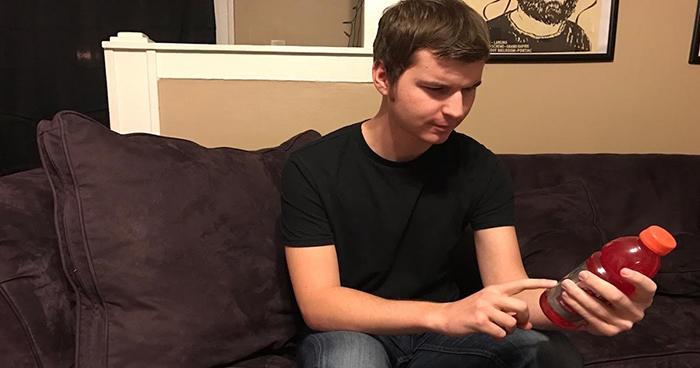
Where is `white molding`? Image resolution: width=700 pixels, height=368 pixels. white molding is located at coordinates (126, 96), (223, 72), (218, 16), (372, 12).